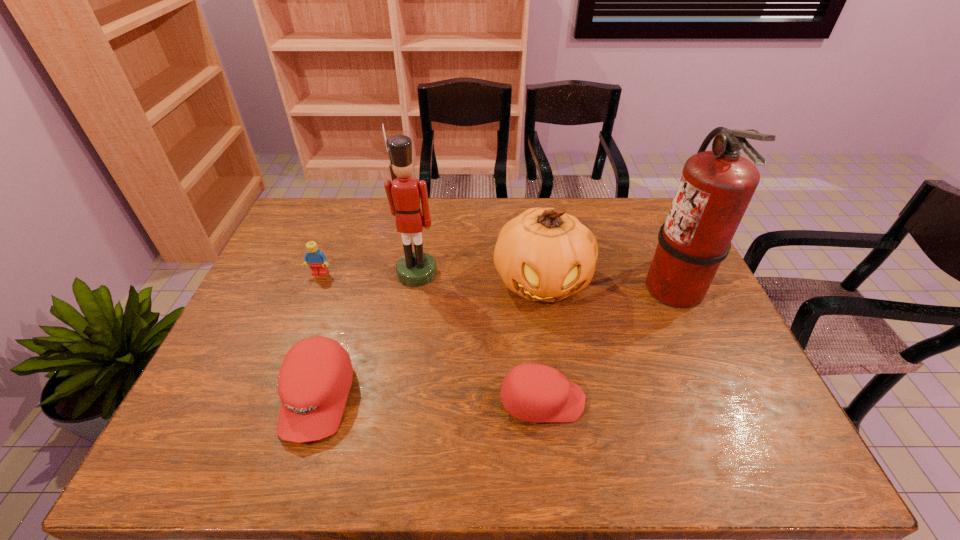
You are a GUI agent. You are given a task and a screenshot of the screen. Output one action in this format:
    pyautogui.click(x=<x>, y=<y>)
    Task: Click on the left cap
    The image size is (960, 540).
    Given the screenshot: What is the action you would take?
    pyautogui.click(x=315, y=377)

The image size is (960, 540). I want to click on the shortest object, so click(536, 393).

Find the location of a particular element. The image size is (960, 540). the right cap is located at coordinates [536, 393].

You are a GUI agent. You are given a task and a screenshot of the screen. Output one action in this format:
    pyautogui.click(x=<x>, y=<y>)
    Task: Click on the fourth shortest object
    
    Given the screenshot: What is the action you would take?
    pyautogui.click(x=543, y=254)

Where is `nutcracker`? This screenshot has width=960, height=540. nutcracker is located at coordinates (417, 268).

Find the location of a particular element. The height and width of the screenshot is (540, 960). Lego is located at coordinates (317, 260).

Where is `the rightmost object`? The width and height of the screenshot is (960, 540). the rightmost object is located at coordinates (715, 188).

I want to click on free space located on the front-facing side of the shortest object, so click(750, 401).

You are a GUI agent. You are given a task and a screenshot of the screen. Output one action in this format:
    pyautogui.click(x=<x>, y=<y>)
    Task: Click on the free spot located 0.200m on the front face of the third tallest object
    The width and height of the screenshot is (960, 540).
    Given the screenshot: What is the action you would take?
    pyautogui.click(x=557, y=379)

Where is `vacant space located on the front-facing side of the nutcracker`? vacant space located on the front-facing side of the nutcracker is located at coordinates (413, 301).